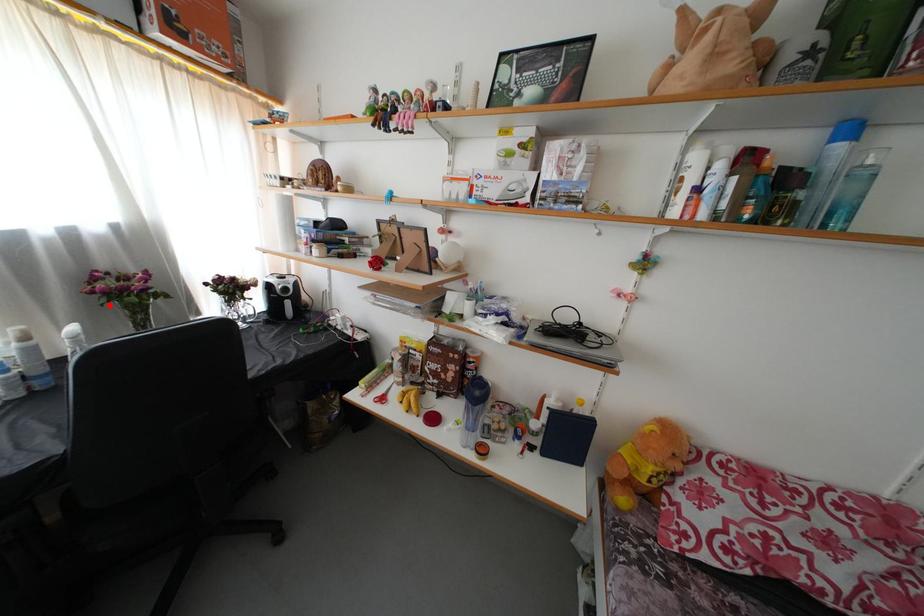
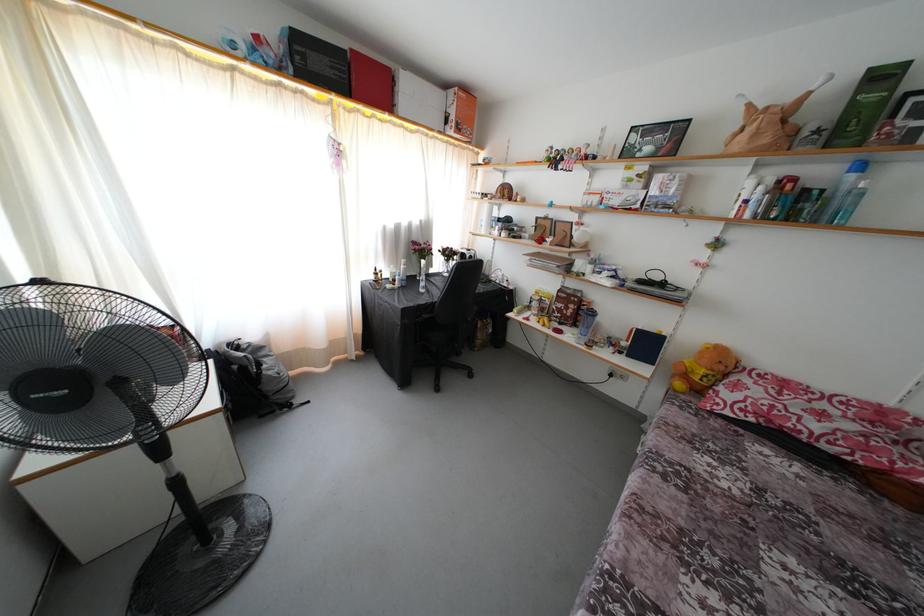
Question: I am providing you with two images of the same scene from different viewpoints. A red point is marked on the first image. At the location where the point appears in image 1, is it still visible in image 2?

Choices:
 (A) Yes
 (B) No

Answer: (A)